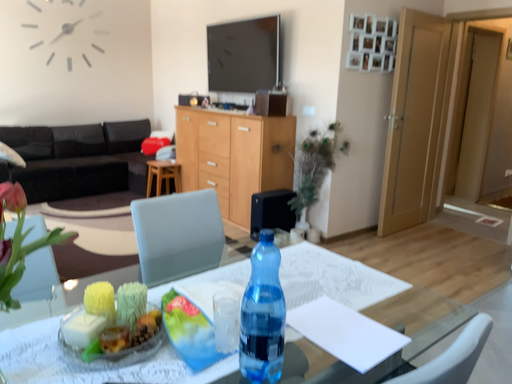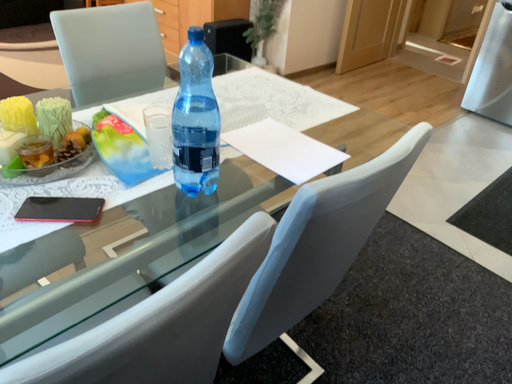
Question: Which way did the camera rotate in the video?

Choices:
 (A) rotated downward
 (B) rotated upward

Answer: (A)